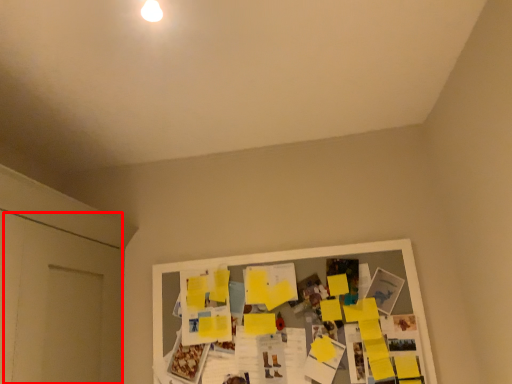
Question: Considering the relative positions of door (annotated by the red box) and bulletin board in the image provided, where is door (annotated by the red box) located with respect to the staircase?

Choices:
 (A) right
 (B) left

Answer: (B)